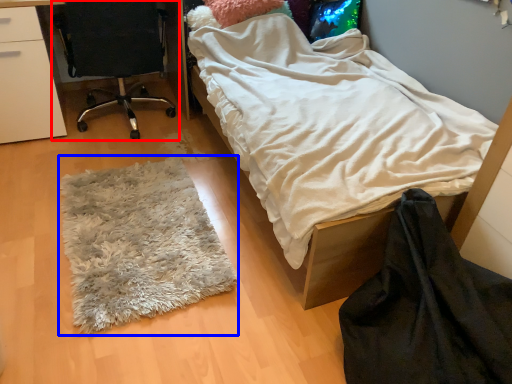
Question: Which of the following is the closest to the observer, chair (highlighted by a red box) or mat (highlighted by a blue box)?

Choices:
 (A) chair
 (B) mat

Answer: (B)